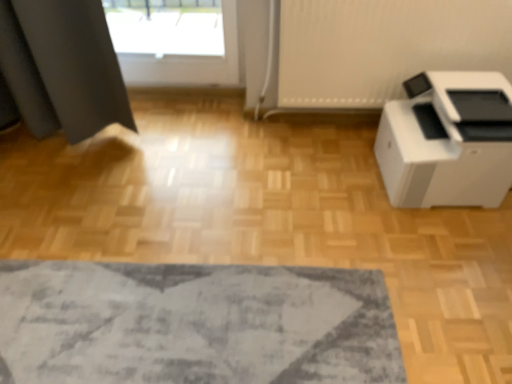
Question: Is white plastic printer at right further to camera compared to textured gray rug at lower center?

Choices:
 (A) yes
 (B) no

Answer: (A)

Question: Is white plastic printer at right to the left of textured gray rug at lower center from the viewer's perspective?

Choices:
 (A) yes
 (B) no

Answer: (B)

Question: Is white plastic printer at right taller than textured gray rug at lower center?

Choices:
 (A) yes
 (B) no

Answer: (A)

Question: Is white plastic printer at right beside textured gray rug at lower center?

Choices:
 (A) yes
 (B) no

Answer: (B)

Question: Is white plastic printer at right positioned before textured gray rug at lower center?

Choices:
 (A) yes
 (B) no

Answer: (B)

Question: From the image's perspective, does white plastic printer at right appear lower than textured gray rug at lower center?

Choices:
 (A) yes
 (B) no

Answer: (B)

Question: Considering the relative positions of textured gray rug at lower center and white plastic printer at right in the image provided, is textured gray rug at lower center to the right of white plastic printer at right from the viewer's perspective?

Choices:
 (A) yes
 (B) no

Answer: (B)

Question: Is textured gray rug at lower center positioned far away from white plastic printer at right?

Choices:
 (A) no
 (B) yes

Answer: (A)

Question: From the image's perspective, does textured gray rug at lower center appear lower than white plastic printer at right?

Choices:
 (A) yes
 (B) no

Answer: (A)

Question: Is textured gray rug at lower center aimed at white plastic printer at right?

Choices:
 (A) no
 (B) yes

Answer: (A)

Question: Is textured gray rug at lower center at the left side of white plastic printer at right?

Choices:
 (A) no
 (B) yes

Answer: (B)

Question: Does textured gray rug at lower center have a smaller size compared to white plastic printer at right?

Choices:
 (A) no
 (B) yes

Answer: (B)

Question: From a real-world perspective, is textured gray rug at lower center positioned above or below white plastic printer at right?

Choices:
 (A) below
 (B) above

Answer: (A)